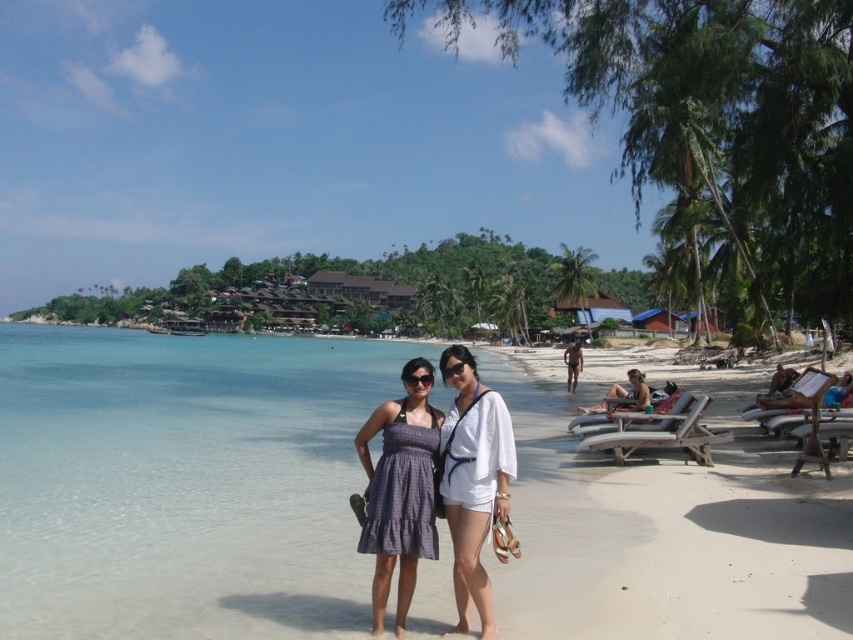
Question: Which point is closer to the camera?

Choices:
 (A) tan skin man at center
 (B) white sand beach at center
 (C) tan skin man at lower right

Answer: (B)

Question: Which is nearer to the white cotton shorts at center?

Choices:
 (A) matte purple dress at center
 (B) tan skin man at center

Answer: (A)

Question: Is white sand beach at center above tan skin man at center?

Choices:
 (A) yes
 (B) no

Answer: (B)

Question: Which point is farther to the camera?

Choices:
 (A) (457, 449)
 (B) (73, 435)
 (C) (502, 460)

Answer: (B)

Question: Does white sand beach at center have a smaller size compared to white cotton shorts at center?

Choices:
 (A) yes
 (B) no

Answer: (B)

Question: Is white sand beach at center wider than tan skin man at center?

Choices:
 (A) yes
 (B) no

Answer: (A)